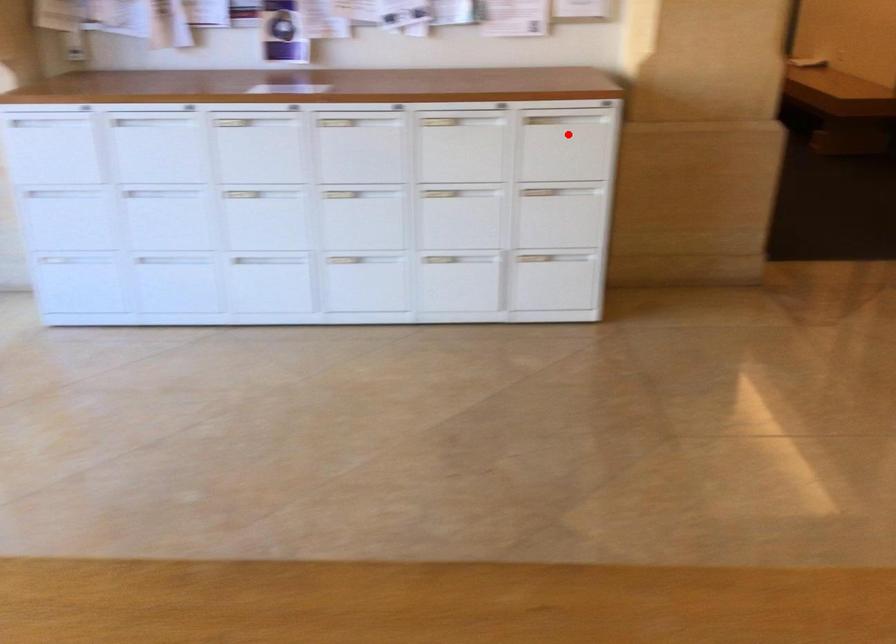
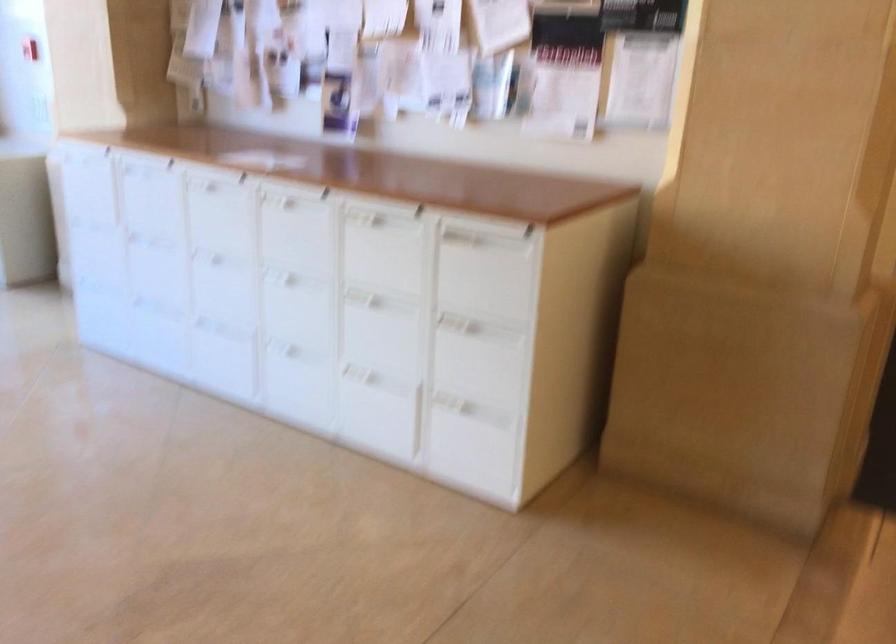
Question: I am providing you with two images of the same scene from different viewpoints. In image1, a red point is highlighted. Considering the same 3D point in image2, which of the following is correct?

Choices:
 (A) It is closer
 (B) It is farther

Answer: (A)